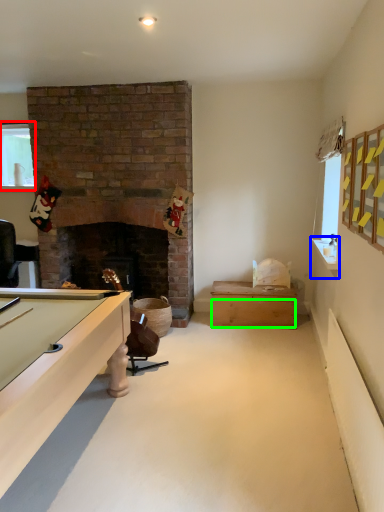
Question: Which object is positioned farthest from window (highlighted by a red box)? Select from counter top (highlighted by a blue box) and drawer (highlighted by a green box).

Choices:
 (A) counter top
 (B) drawer

Answer: (A)